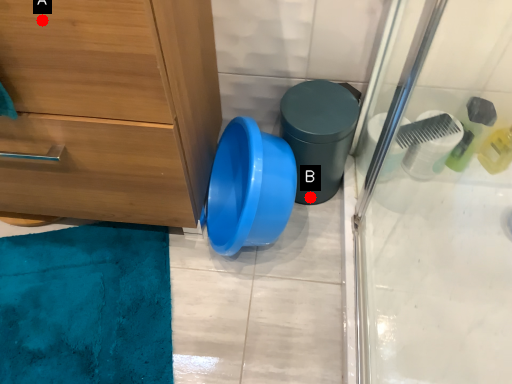
Question: Two points are circled on the image, labeled by A and B beside each circle. Which point appears closest to the camera in this image?

Choices:
 (A) A is closer
 (B) B is closer

Answer: (A)